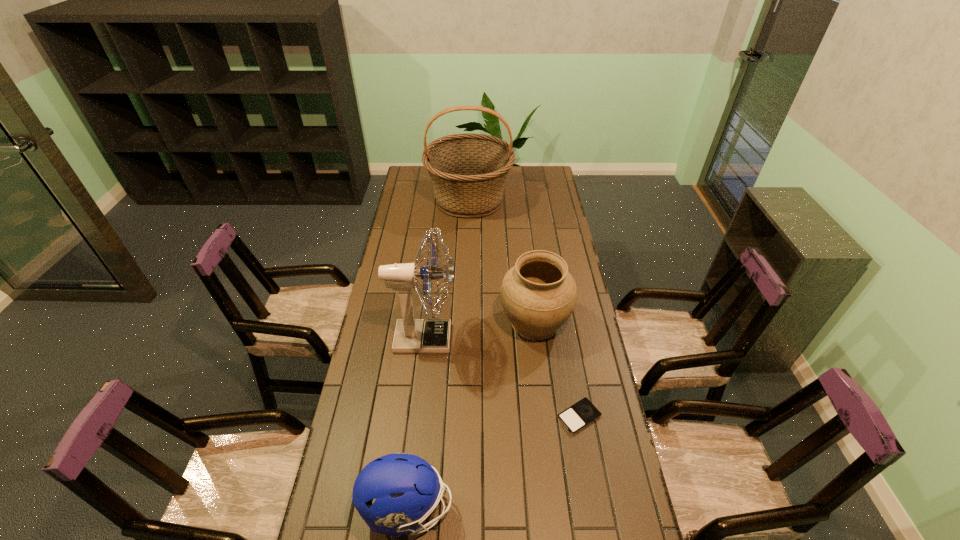
Find the location of a particular element. This screenshot has height=540, width=960. basket situated at the left edge is located at coordinates (468, 171).

Identify the location of fan that is at the left edge. (412, 335).

Find the location of a particular element. urn located in the right edge section of the desktop is located at coordinates (538, 294).

This screenshot has width=960, height=540. I want to click on iPod situated at the right edge, so click(579, 415).

Locate an element on the screen. object that is positioned at the far left corner is located at coordinates click(x=468, y=171).

The height and width of the screenshot is (540, 960). In the image, there is a desktop. Find the location of `vacant space at the left edge`. vacant space at the left edge is located at coordinates (403, 221).

Locate an element on the screen. This screenshot has width=960, height=540. free space at the right edge is located at coordinates (587, 342).

Where is `vacant space at the far left corner of the desktop`? vacant space at the far left corner of the desktop is located at coordinates (414, 176).

Where is `vacant space in between the third shortest object and the fourth farthest object`? vacant space in between the third shortest object and the fourth farthest object is located at coordinates (557, 369).

In order to click on free space between the fan and the farthest object in this screenshot , I will do `click(447, 269)`.